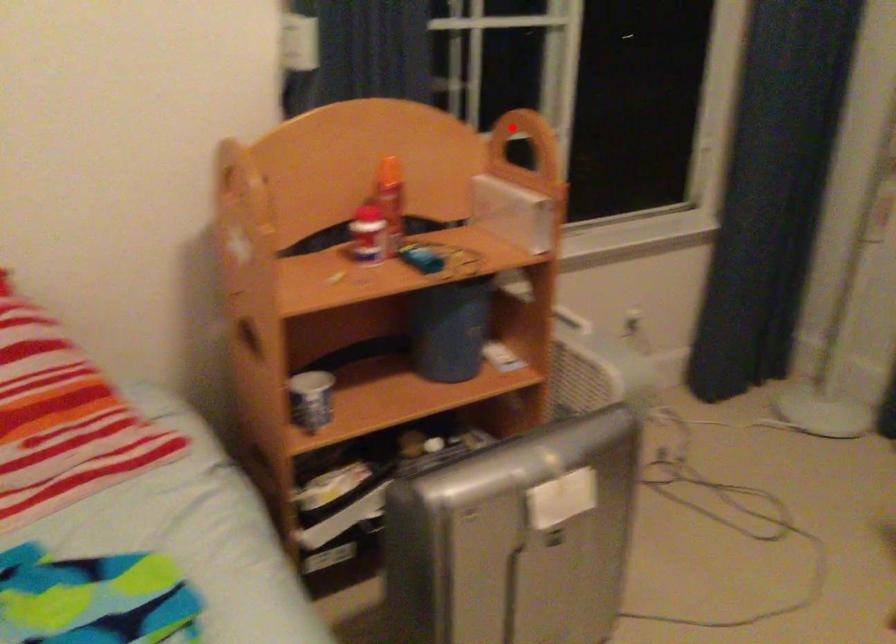
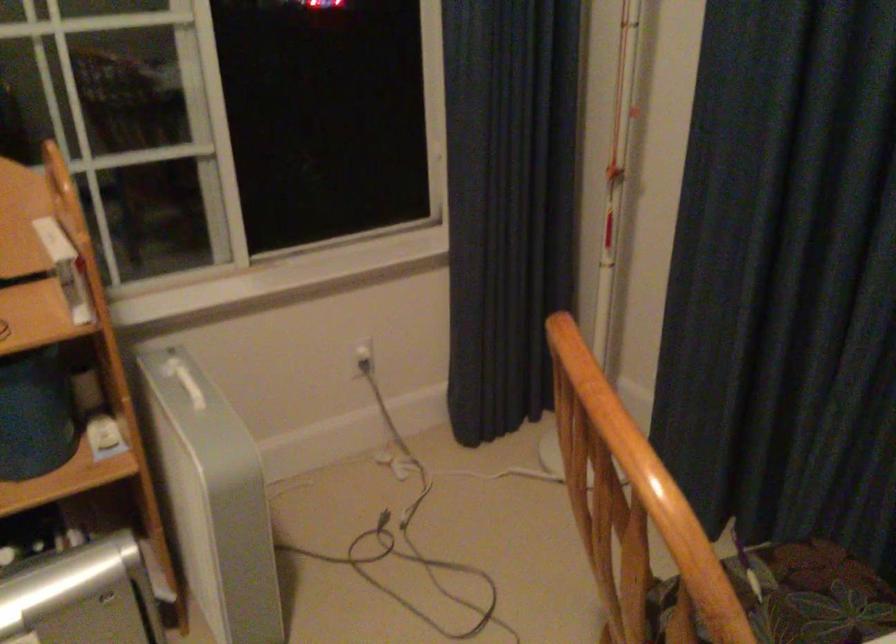
Question: I am providing you with two images of the same scene from different viewpoints. A red point is marked on the first image. At the location where the point appears in image 1, is it still visible in image 2?

Choices:
 (A) Yes
 (B) No

Answer: (B)